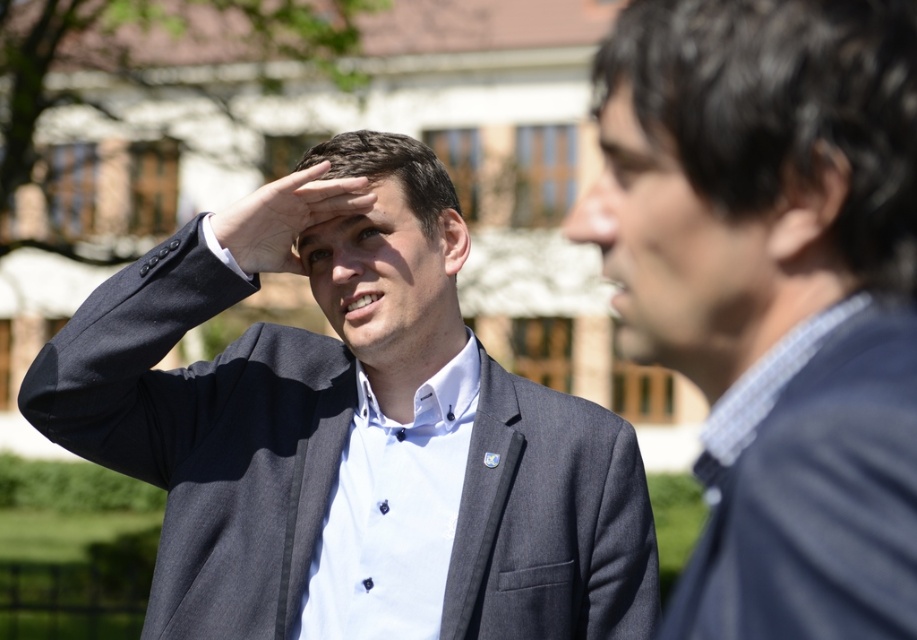
Question: Can you confirm if matte skin forehead at center is smaller than matte skin ear at center?

Choices:
 (A) no
 (B) yes

Answer: (A)

Question: Based on their relative distances, which object is nearer to the blue textured fabric at right?

Choices:
 (A) white matte hand at center
 (B) matte black hair at center

Answer: (A)

Question: Can you confirm if matte gray suit at center is smaller than matte skin forehead at center?

Choices:
 (A) no
 (B) yes

Answer: (A)

Question: Considering the relative positions of dark brown hair at upper right and brown matte eye at center in the image provided, where is dark brown hair at upper right located with respect to brown matte eye at center?

Choices:
 (A) above
 (B) below

Answer: (A)

Question: Among these objects, which one is nearest to the camera?

Choices:
 (A) matte black hair at center
 (B) black matte ear at upper right
 (C) blue textured fabric at right
 (D) matte skin ear at center

Answer: (C)

Question: Which point appears closest to the camera in this image?

Choices:
 (A) (899, 456)
 (B) (906, 93)

Answer: (A)